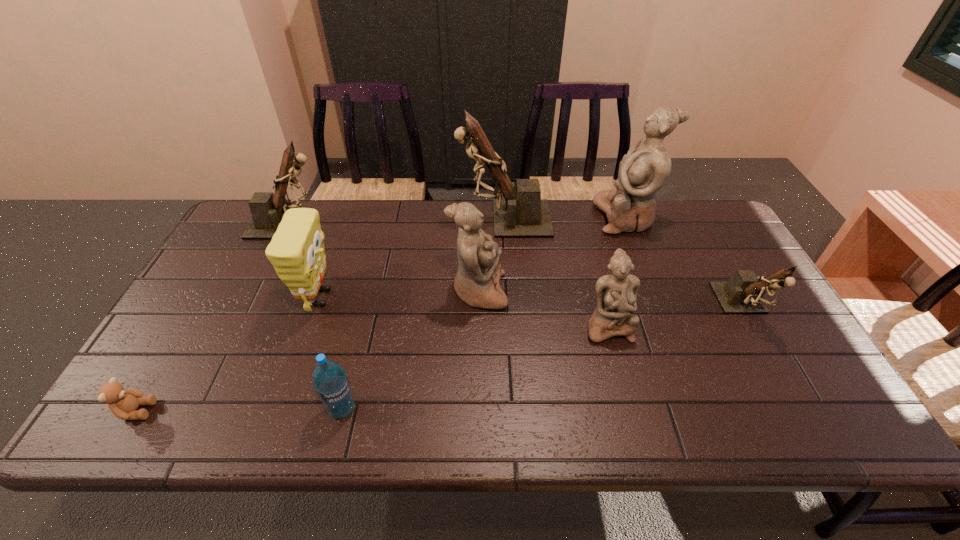
Identify the location of vacant space positioned on the front-facing side of the second biggest white figurine. The height and width of the screenshot is (540, 960). (618, 292).

This screenshot has width=960, height=540. I want to click on vacant point located 0.220m on the face of the sponge, so click(x=419, y=298).

Identify the location of free space located on the front-facing side of the smallest white figurine. This screenshot has width=960, height=540. (622, 380).

Identify the location of free point located on the front-facing side of the rightmost object. (777, 368).

Where is `vacant point located on the left of the water bottle`? vacant point located on the left of the water bottle is located at coordinates (219, 409).

You are a GUI agent. You are given a task and a screenshot of the screen. Output one action in this format:
    pyautogui.click(x=<x>, y=<y>)
    Task: Click on the vacant area situated 0.320m on the face of the teddy bear
    The height and width of the screenshot is (540, 960).
    Given the screenshot: What is the action you would take?
    pyautogui.click(x=298, y=410)

Identify the location of water bottle at the near edge. (330, 381).

What are the coordinates of `teddy bear located at the near edge` in the screenshot? It's located at (123, 403).

Find the location of a particular element. figurine situated at the left edge is located at coordinates (267, 209).

Where is `teddy bear present at the left edge`? The height and width of the screenshot is (540, 960). teddy bear present at the left edge is located at coordinates (123, 403).